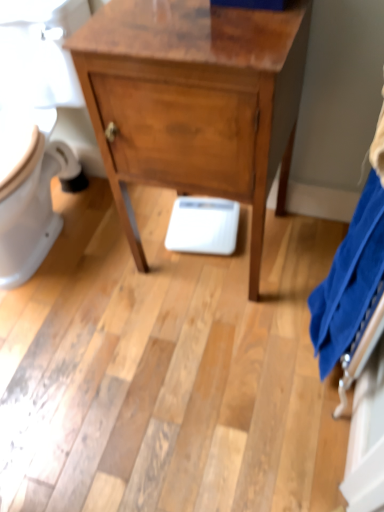
Locate an element on the screen. The width and height of the screenshot is (384, 512). vacant area situated to the left side of wooden chest of drawers at center is located at coordinates (118, 286).